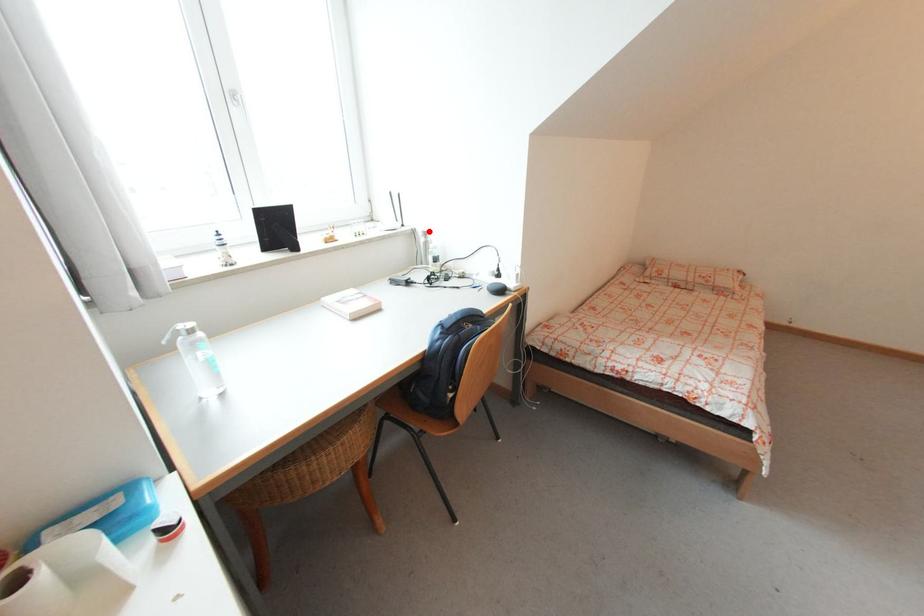
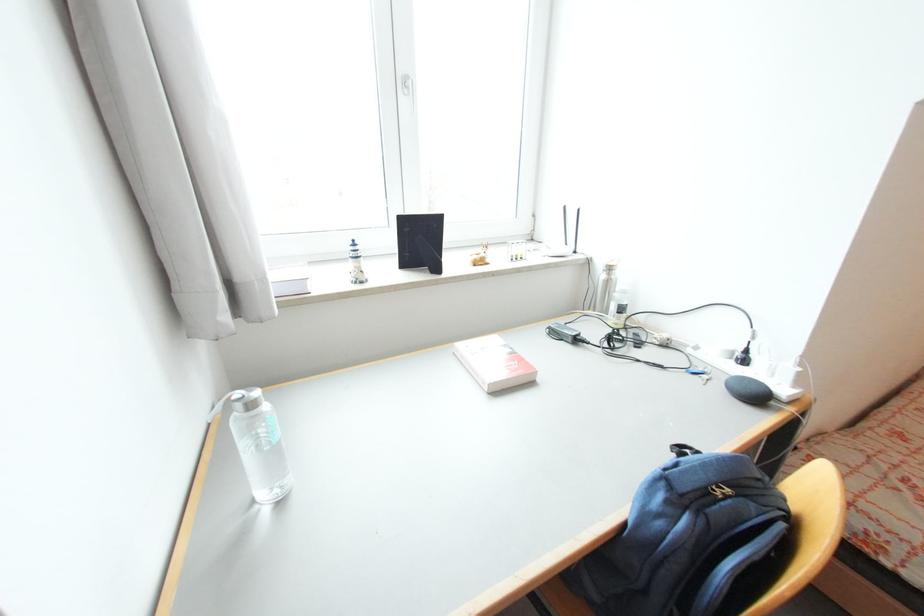
Find the pixel in the second image that matches the highlighted location in the first image.

(614, 265)